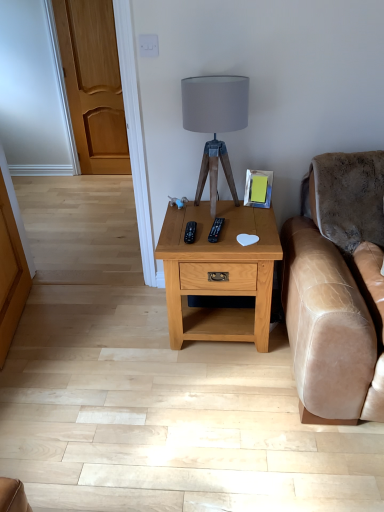
Find the location of a particular element. This screenshot has height=512, width=384. vacant space that's between black plastic remote at center, the 1th remote in the right-to-left sequence, and matte gray fabric lampshade at center is located at coordinates (229, 226).